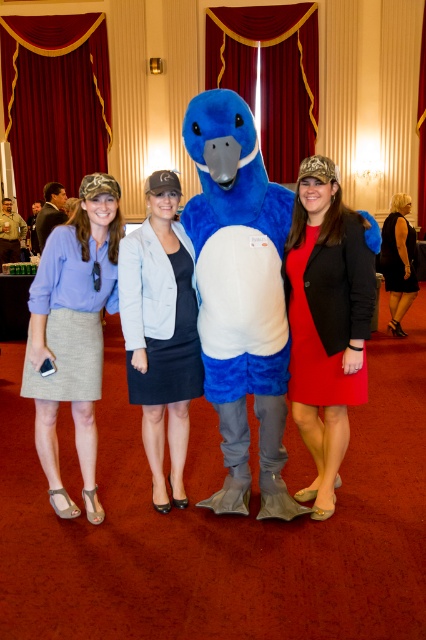
Question: Which of the following is the closest to the observer?

Choices:
 (A) (406, 200)
 (B) (187, 211)
 (C) (43, 310)
 (D) (127, 355)

Answer: (C)

Question: Does fuzzy blue mascot at center lie behind light gray woven skirt at left?

Choices:
 (A) yes
 (B) no

Answer: (B)

Question: Is matte blue dress at center positioned behind dark blue fabric dress at center?

Choices:
 (A) yes
 (B) no

Answer: (B)

Question: Among these points, which one is farthest from the camera?

Choices:
 (A) (164, 321)
 (B) (244, 378)
 (C) (54, 499)
 (D) (92, 355)

Answer: (C)

Question: Which object is closer to the camera taking this photo?

Choices:
 (A) matte gray skirt at left
 (B) dark blue fabric dress at center
 (C) red matte dress at center
 (D) fuzzy blue mascot at center

Answer: (D)

Question: Is red matte dress at center positioned before light gray woven skirt at left?

Choices:
 (A) no
 (B) yes

Answer: (A)